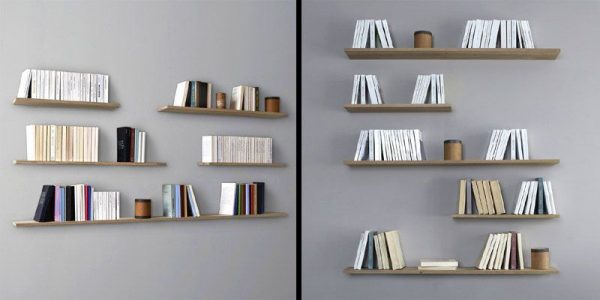
At what (x,y) coordinates should I click in order to perform the action: click on decorations. Please return your answer as a coordinate pair (x, y). The width and height of the screenshot is (600, 300). Looking at the image, I should click on (146, 210), (224, 101), (274, 104), (424, 38), (457, 147), (544, 260).